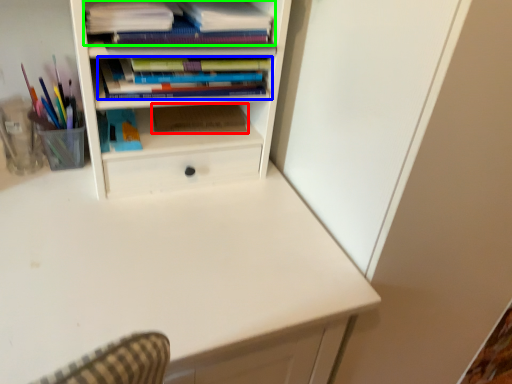
Question: Which object is positioned closest to paperback book (highlighted by a red box)? Select from book (highlighted by a blue box) and book (highlighted by a green box).

Choices:
 (A) book
 (B) book

Answer: (A)